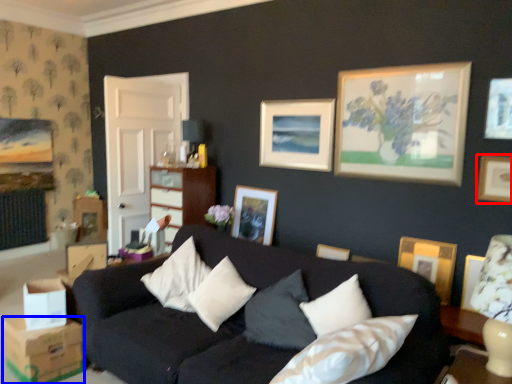
Question: Which point is closer to the camera, picture frame (highlighted by a red box) or cardboard box (highlighted by a blue box)?

Choices:
 (A) picture frame
 (B) cardboard box

Answer: (B)